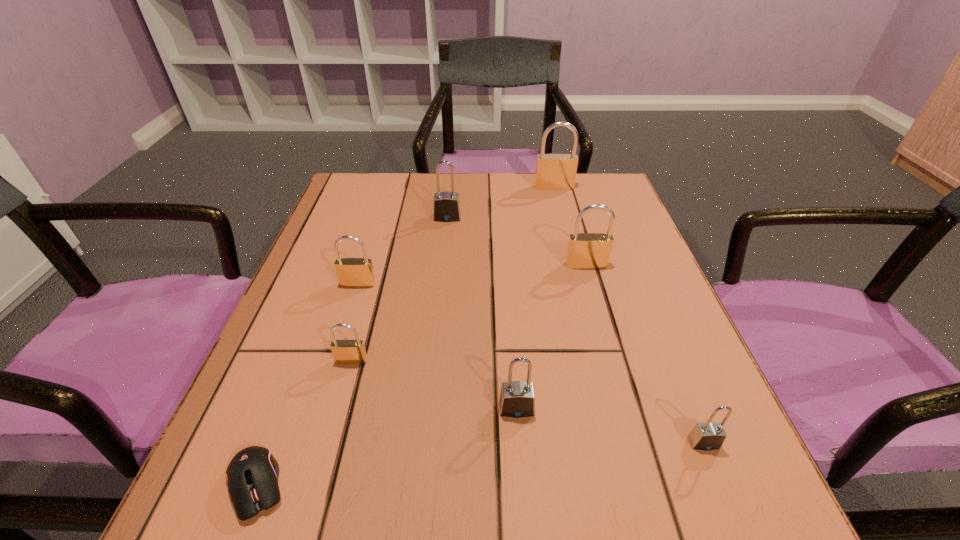
This screenshot has width=960, height=540. Identify the location of the tallest padlock. (553, 171).

At what (x,y) coordinates should I click in order to perform the action: click on the tallest object. Please return your answer as a coordinate pair (x, y). Looking at the image, I should click on (553, 171).

Where is `the leftmost gray padlock`? The height and width of the screenshot is (540, 960). the leftmost gray padlock is located at coordinates (446, 205).

Where is `the fourth object from left to right`? The image size is (960, 540). the fourth object from left to right is located at coordinates (446, 205).

Locate an element on the screen. The height and width of the screenshot is (540, 960). the second biggest brass padlock is located at coordinates pyautogui.click(x=585, y=250).

Identify the location of the sixth nearest object. The height and width of the screenshot is (540, 960). [x=585, y=250].

Image resolution: width=960 pixels, height=540 pixels. I want to click on the sixth farthest object, so click(517, 399).

Image resolution: width=960 pixels, height=540 pixels. In order to click on the second gray padlock from right to left in this screenshot , I will do `click(517, 399)`.

This screenshot has height=540, width=960. I want to click on the fourth nearest padlock, so click(352, 272).

Find the location of `the third biggest brass padlock`. the third biggest brass padlock is located at coordinates click(352, 272).